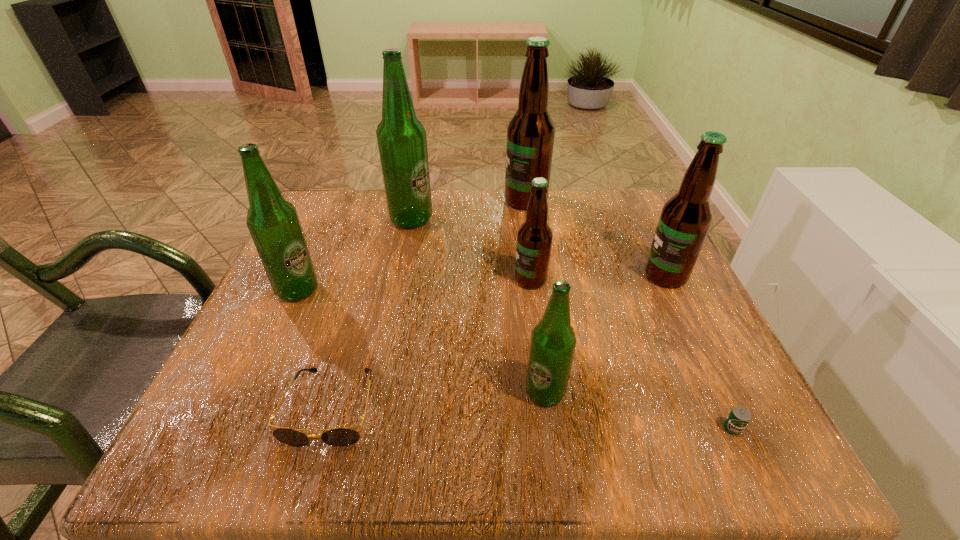
The width and height of the screenshot is (960, 540). Find the location of `vacant point that satisfies the following two spatial constraints: 1. on the label of the rightmost beer bottle; 2. on the front-facing side of the black sunglasses`. vacant point that satisfies the following two spatial constraints: 1. on the label of the rightmost beer bottle; 2. on the front-facing side of the black sunglasses is located at coordinates (730, 407).